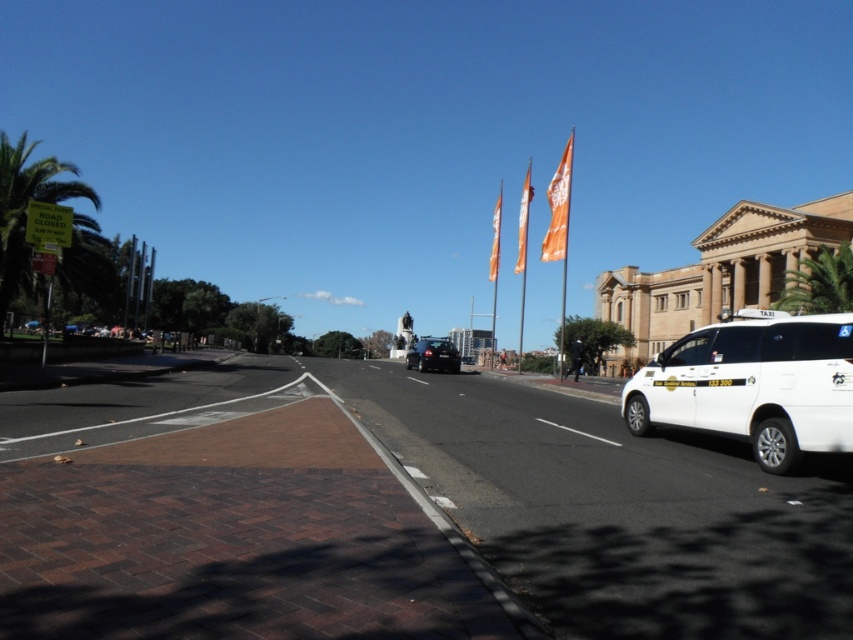
Is green leafy palm tree at right in front of orange fabric flag at upper right?

No.

Is green leafy palm tree at right smaller than orange fabric flag at upper right?

Yes.

The image size is (853, 640). Find the location of `green leafy palm tree at right`. green leafy palm tree at right is located at coordinates [x=819, y=282].

Between orange fabric flag at upper right and shiny black sedan at center, which one is positioned higher?

orange fabric flag at upper right is above.

Where is `orange fabric flag at upper right`? This screenshot has width=853, height=640. orange fabric flag at upper right is located at coordinates (558, 205).

At what (x,y) coordinates should I click in order to perform the action: click on orange fabric flag at upper right. Please return your answer as a coordinate pair (x, y). Looking at the image, I should click on [558, 205].

Is orange fabric flag at upper right bigger than orange fabric flag at center?

Indeed, orange fabric flag at upper right has a larger size compared to orange fabric flag at center.

Does orange fabric flag at upper right appear over orange fabric flag at center?

Yes.

Who is more forward, (x=554, y=173) or (x=521, y=218)?

Point (x=521, y=218)

Locate an element on the screen. This screenshot has width=853, height=640. orange fabric flag at upper right is located at coordinates (558, 205).